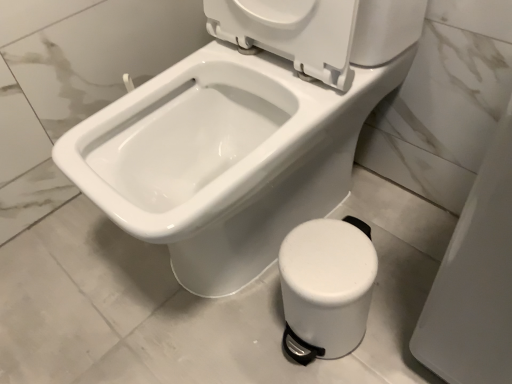
The height and width of the screenshot is (384, 512). I want to click on free region on the left part of white plastic pedal bin at lower right, so click(232, 329).